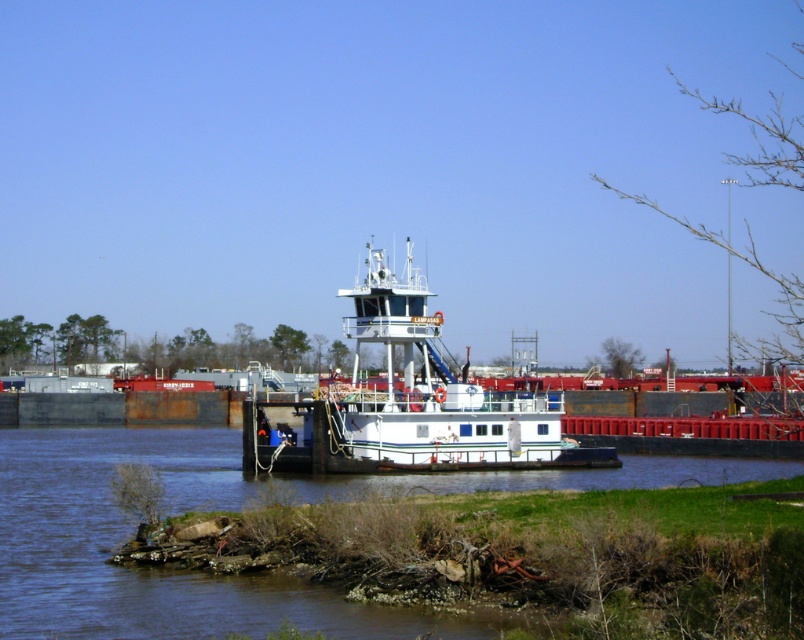
You are a photographer standing on the pier and want to capture both the blue painted steel river at center and the white matte tugboat at center in a single shot. Which object should you position closer to the bottom of your camera frame to include both in the composition?

You should position the blue painted steel river at center closer to the bottom of your camera frame since it is located below the white matte tugboat at center, allowing both to be included in the composition.

In the scene shown: You are standing on the grassy bank near the water and want to board the blue painted steel river at center. Which direction should you head to reach it?

The blue painted steel river at center is located at point (129, 532), so you should head towards the coordinates provided to reach it.

You are a photographer planning to capture the blue painted steel river at center and the white matte tugboat at center in a single frame. Given that your camera has a fixed focal length, which object should you prioritize positioning closer to the camera to ensure both are visible without cropping?

Since the blue painted steel river at center is larger in size than the white matte tugboat at center, you should prioritize positioning the white matte tugboat at center closer to the camera to ensure both fit within the frame.